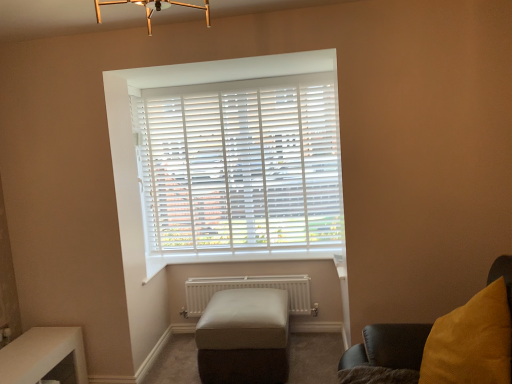
Question: Is point (400, 339) closer or farther from the camera than point (236, 292)?

Choices:
 (A) closer
 (B) farther

Answer: (A)

Question: From a real-world perspective, is velvet yellow cushion at right positioned above or below leather ottoman at center?

Choices:
 (A) above
 (B) below

Answer: (A)

Question: Based on their relative distances, which object is farther from the white matte radiator at lower center?

Choices:
 (A) white plastic blinds at center
 (B) leather ottoman at center
 (C) white glossy table at lower left
 (D) velvet yellow cushion at right

Answer: (D)

Question: Which object is positioned farthest from the white matte radiator at lower center?

Choices:
 (A) velvet yellow cushion at right
 (B) leather ottoman at center
 (C) white glossy table at lower left
 (D) white plastic blinds at center

Answer: (A)